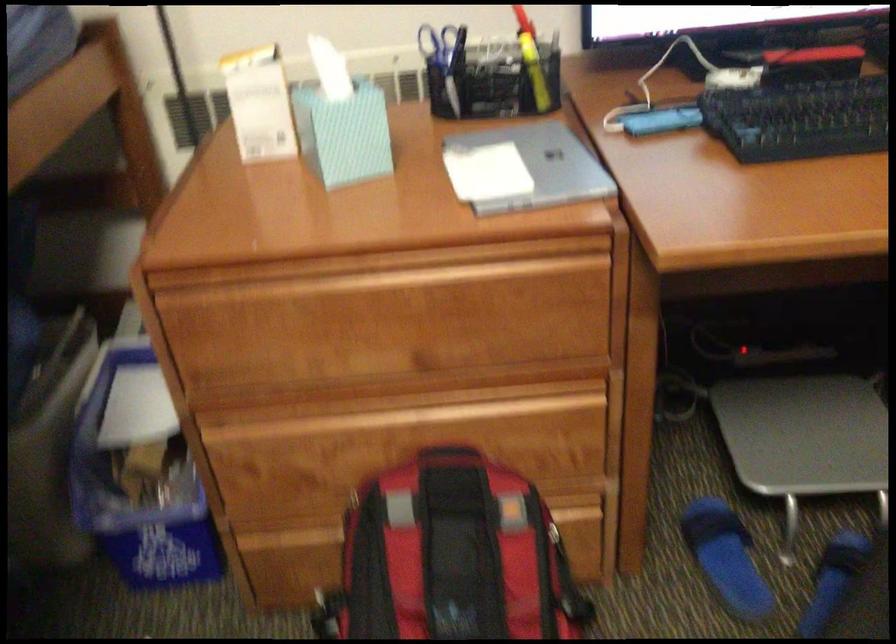
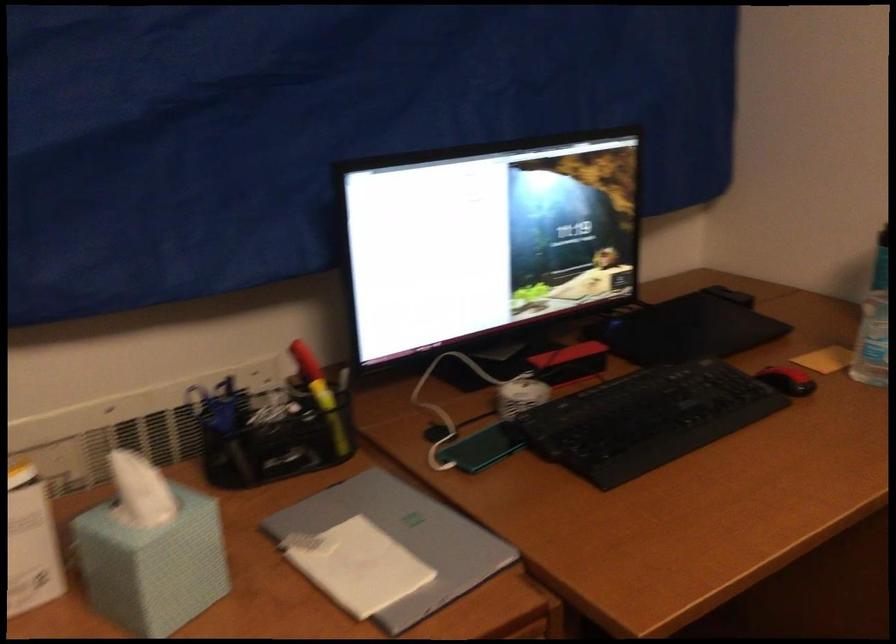
Find the pixel in the second image that matches point (533, 166) in the first image.

(403, 538)